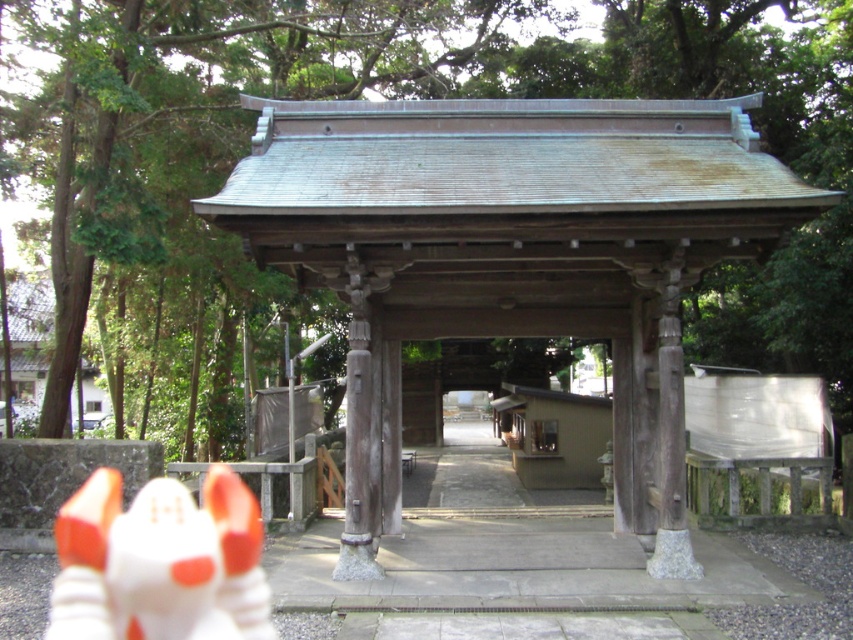
Does wooden gazebo at center appear over white matte toy at lower left?

Yes, wooden gazebo at center is above white matte toy at lower left.

Who is shorter, wooden gazebo at center or white matte toy at lower left?

With less height is wooden gazebo at center.

Measure the distance between wooden gazebo at center and camera.

The distance of wooden gazebo at center from camera is 9.54 meters.

I want to click on wooden gazebo at center, so click(512, 257).